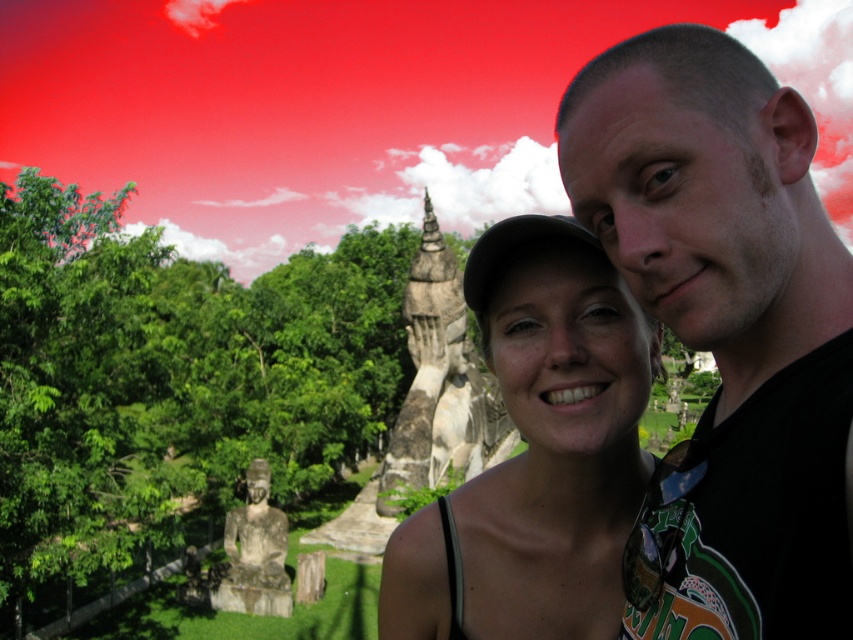
Question: Based on their relative distances, which object is farther from the matte gray statue at center?

Choices:
 (A) green leafy tree at upper left
 (B) black matte shirt at upper right

Answer: (A)

Question: From the image, what is the correct spatial relationship of green leafy tree at upper left in relation to matte gray statue at center?

Choices:
 (A) left
 (B) right

Answer: (A)

Question: Is black matte shirt at upper right smaller than green leafy tree at upper left?

Choices:
 (A) no
 (B) yes

Answer: (B)

Question: Estimate the real-world distances between objects in this image. Which object is closer to the matte gray statue at center?

Choices:
 (A) black matte shirt at upper right
 (B) green leafy tree at upper left

Answer: (A)

Question: Which object is closer to the camera taking this photo?

Choices:
 (A) green leafy tree at upper left
 (B) black matte shirt at upper right

Answer: (B)

Question: Is green leafy tree at upper left to the right of matte gray statue at center from the viewer's perspective?

Choices:
 (A) yes
 (B) no

Answer: (B)